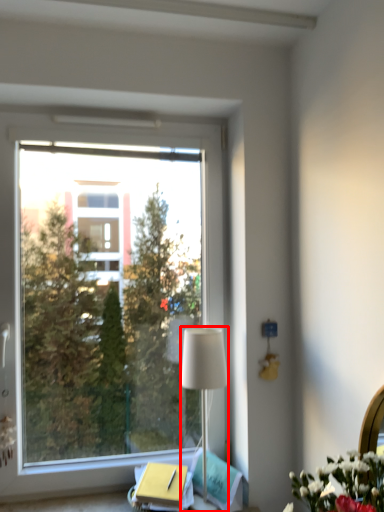
Question: From the image, what is the correct spatial relationship of lamp (annotated by the red box) in relation to window?

Choices:
 (A) right
 (B) left

Answer: (A)